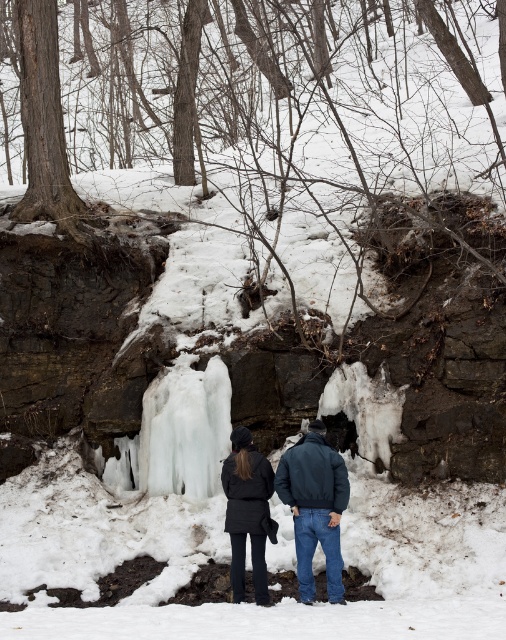
You are standing at the point marked as point [271,468] in a winter forest scene near a frozen waterfall. You want to take a photo of the waterfall from your current position. Considering the distance between you and the viewer, will you be able to capture the entire waterfall in the frame without moving? Please explain your reasoning based on the given information.

The point [271,468] and viewer are 40.58 feet apart from each other. Since the distance is significant, it is likely that you can capture the entire waterfall in the frame without needing to move, as 40.58 feet provides enough space to include the waterfall within the camera view.

You are standing in the winter forest scene and want to take a photo of the icy translucent waterfall at center and the dark gray matte jacket at center. Which object should you focus on first if you want to capture both in the same frame without moving the camera?

The icy translucent waterfall at center should be focused on first because it is positioned to the left of the dark gray matte jacket at center, allowing both to be in the same frame without needing to adjust the camera position.

You are trying to take a photo of both the dark blue jacket at center and the dark gray matte jacket at center. Since you want both to be in focus, which jacket should you focus on first?

You should focus on the dark blue jacket at center first because it is closer to the viewer than the dark gray matte jacket at center, so adjusting focus from near to far will help both be in focus.